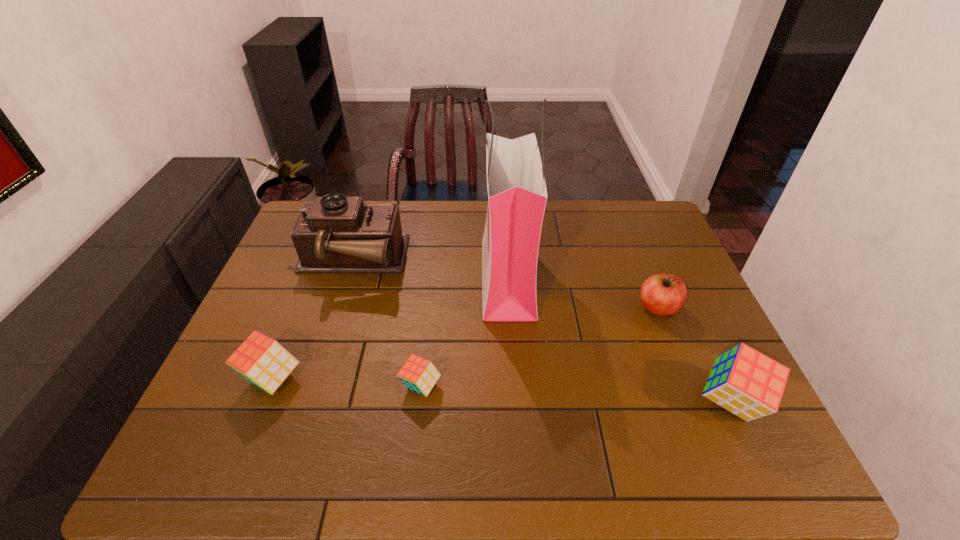
Identify which object is the fourth closest to the tallest object. Please provide its 2D coordinates. Your answer should be formatted as a tuple, i.e. [(x, y)], where the tuple contains the x and y coordinates of a point satisfying the conditions above.

[(749, 384)]

Select which object appears as the fifth closest to the leftmost cube. Please provide its 2D coordinates. Your answer should be formatted as a tuple, i.e. [(x, y)], where the tuple contains the x and y coordinates of a point satisfying the conditions above.

[(749, 384)]

Select which cube is the third closest to the apple. Please provide its 2D coordinates. Your answer should be formatted as a tuple, i.e. [(x, y)], where the tuple contains the x and y coordinates of a point satisfying the conditions above.

[(263, 361)]

Locate an element on the screen. cube object that ranks as the second closest to the apple is located at coordinates pyautogui.click(x=418, y=374).

Where is `free space that satisfies the following two spatial constraints: 1. on the horn of the fifth shortest object; 2. on the right side of the apple`? Image resolution: width=960 pixels, height=540 pixels. free space that satisfies the following two spatial constraints: 1. on the horn of the fifth shortest object; 2. on the right side of the apple is located at coordinates (332, 307).

The height and width of the screenshot is (540, 960). In order to click on vacant space that satisfies the following two spatial constraints: 1. on the back side of the apple; 2. on the front-facing side of the tallest object in this screenshot , I will do `click(646, 278)`.

Find the location of a particular element. This screenshot has height=540, width=960. vacant space that satisfies the following two spatial constraints: 1. on the front-facing side of the apple; 2. on the left side of the shopping bag is located at coordinates (510, 307).

Locate an element on the screen. The image size is (960, 540). free spot that satisfies the following two spatial constraints: 1. on the front-facing side of the fourth object from left to right; 2. on the front side of the leftmost cube is located at coordinates (515, 378).

I want to click on vacant space that satisfies the following two spatial constraints: 1. on the horn of the rightmost cube; 2. on the right side of the phonograph_record, so click(301, 401).

This screenshot has width=960, height=540. Identify the location of blank space that satisfies the following two spatial constraints: 1. on the horn of the fifth shortest object; 2. on the front side of the second tallest cube. (309, 378).